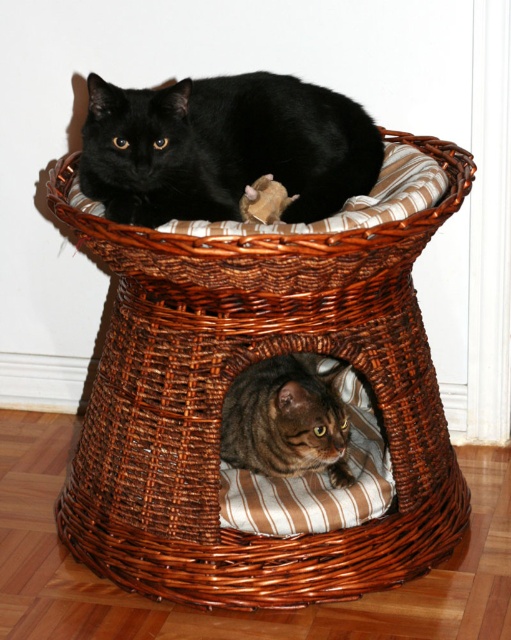
Question: Does brown wicker basket at center appear on the left side of tabby fur cat at center?

Choices:
 (A) no
 (B) yes

Answer: (B)

Question: Does tabby fur cat at upper center appear on the right side of tabby fur cat at center?

Choices:
 (A) no
 (B) yes

Answer: (A)

Question: Which object appears closest to the camera in this image?

Choices:
 (A) tabby fur cat at center
 (B) brown wicker basket at center
 (C) tabby fur cat at upper center

Answer: (B)

Question: Is tabby fur cat at upper center thinner than tabby fur cat at center?

Choices:
 (A) yes
 (B) no

Answer: (B)

Question: Which of the following is the farthest from the observer?

Choices:
 (A) (260, 435)
 (B) (359, 106)
 (C) (198, 307)

Answer: (B)

Question: Which object is closer to the camera taking this photo?

Choices:
 (A) tabby fur cat at center
 (B) tabby fur cat at upper center

Answer: (B)